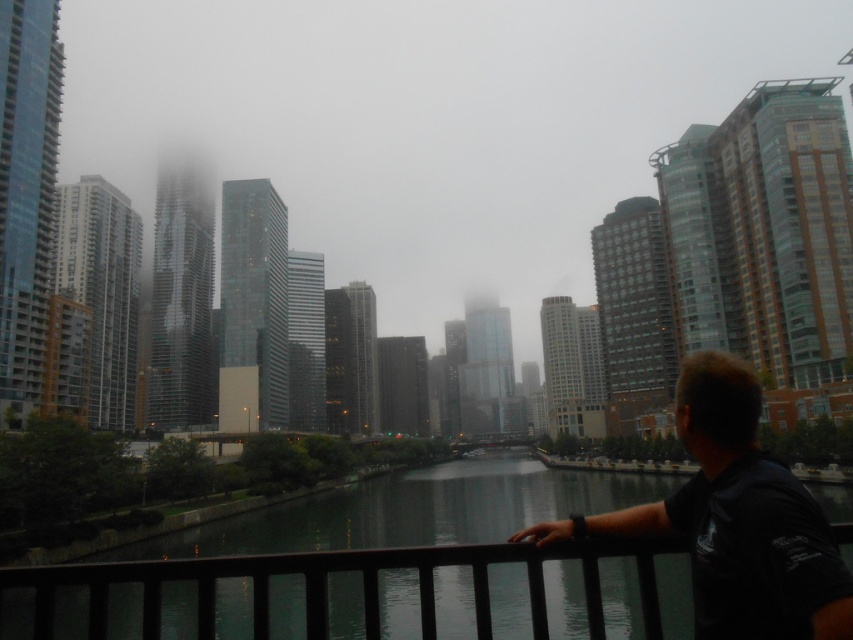
Is dark glass water at center further to the viewer compared to black matte shirt at lower right?

Yes, dark glass water at center is behind black matte shirt at lower right.

The image size is (853, 640). Describe the element at coordinates (396, 525) in the screenshot. I see `dark glass water at center` at that location.

What are the coordinates of `dark glass water at center` in the screenshot? It's located at (396, 525).